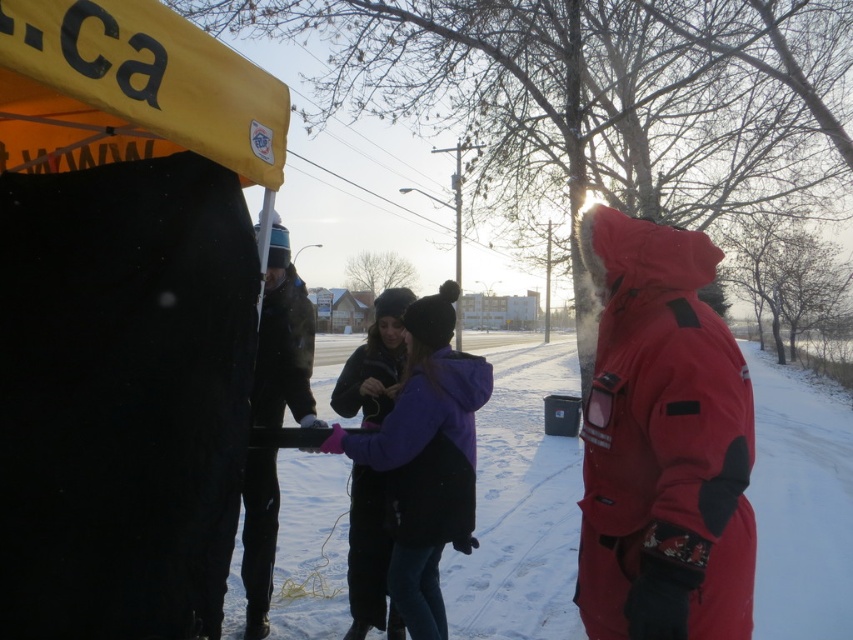
Question: Can you confirm if dark green fabric jacket at center is positioned below metallic pole at center?

Choices:
 (A) no
 (B) yes

Answer: (B)

Question: Which object is closer to the camera taking this photo?

Choices:
 (A) metallic pole at center
 (B) white fluffy snow at center
 (C) dark green fabric jacket at center
 (D) purple fleece jacket at center

Answer: (C)

Question: Is white fluffy snow at center bigger than metallic pole at center?

Choices:
 (A) yes
 (B) no

Answer: (A)

Question: Does purple fleece jacket at center have a smaller size compared to metallic pole at center?

Choices:
 (A) yes
 (B) no

Answer: (A)

Question: Which of the following is the closest to the observer?

Choices:
 (A) metallic pole at center
 (B) dark green fabric jacket at center
 (C) white fluffy snow at center
 (D) purple fleece jacket at center

Answer: (B)

Question: Among these points, which one is nearest to the camera?

Choices:
 (A) (283, 387)
 (B) (460, 189)

Answer: (A)